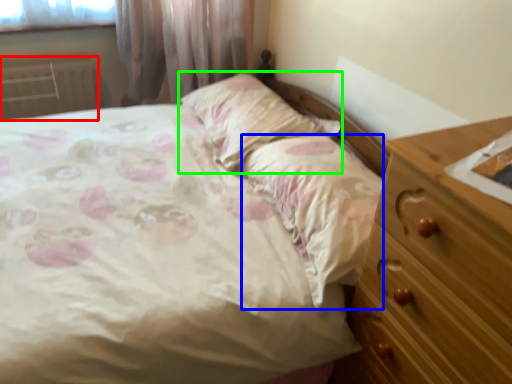
Question: Considering the real-world distances, which object is closest to radiator (highlighted by a red box)? sheet (highlighted by a blue box) or pillow (highlighted by a green box).

Choices:
 (A) sheet
 (B) pillow

Answer: (B)